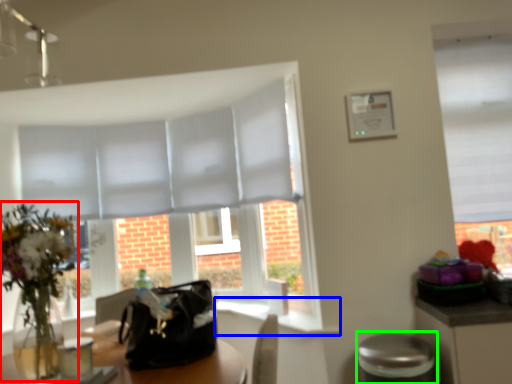
Question: Which is nearer to the floral arrangement (highlighted by a red box)? window sill (highlighted by a blue box) or bar stool (highlighted by a green box).

Choices:
 (A) window sill
 (B) bar stool

Answer: (B)